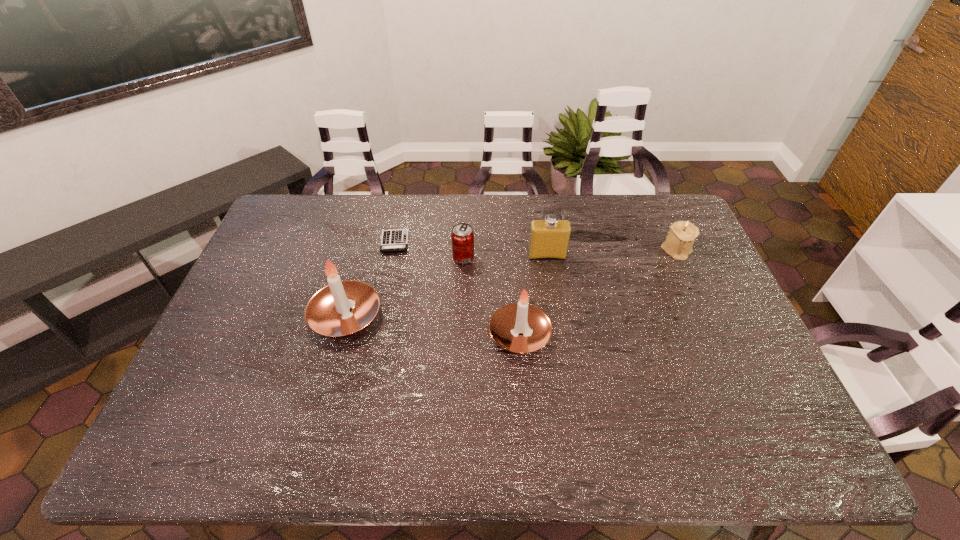
At what (x,y) coordinates should I click in order to perform the action: click on vacant spot to place a candle on the right. Please return your answer as a coordinate pair (x, y). The height and width of the screenshot is (540, 960). Looking at the image, I should click on (708, 354).